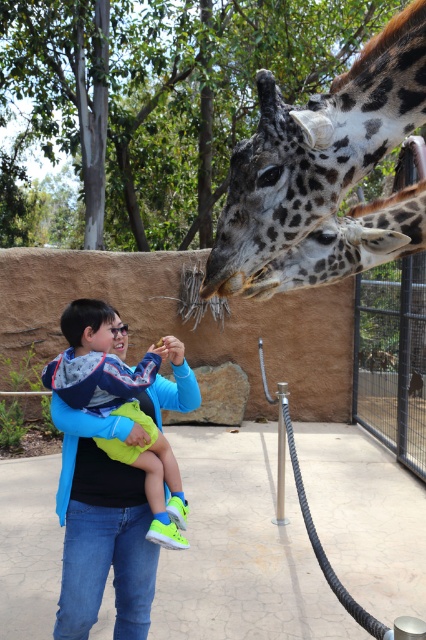
You are standing at the entrance of the zoo and see the spotted fur giraffe at center. If you walk straight ahead, will you approach the giraffe?

The spotted fur giraffe at center is located at point (324, 173), which means it is positioned to the left and slightly below your current viewpoint. Walking straight ahead might not directly lead you toward it. You might need to adjust your direction slightly to the left to approach the giraffe.